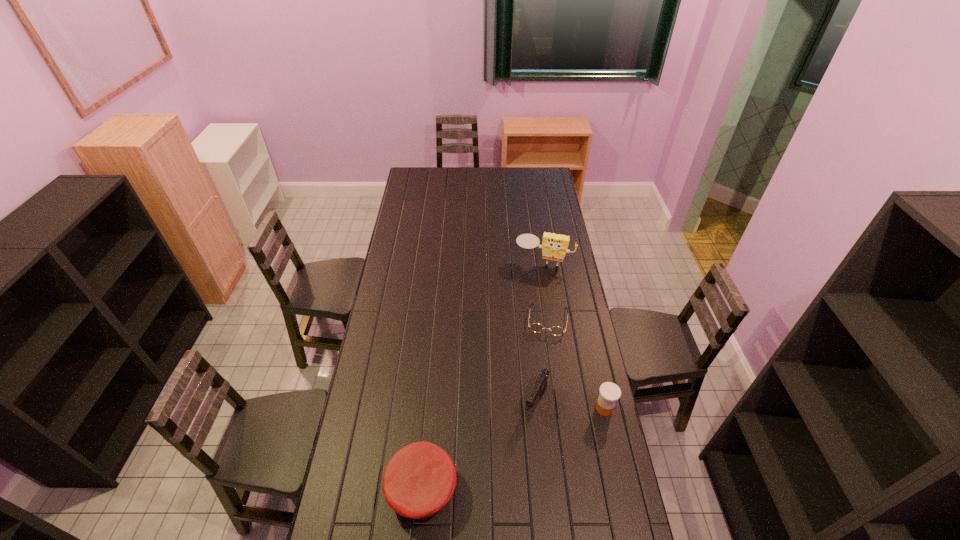
In order to click on free region at the right edge of the desktop in this screenshot , I will do `click(539, 199)`.

Where is `free space at the far right corner`? The image size is (960, 540). free space at the far right corner is located at coordinates (538, 172).

You are a GUI agent. You are given a task and a screenshot of the screen. Output one action in this format:
    pyautogui.click(x=<x>, y=<y>)
    Task: Click on the empty space that is in between the second farthest object and the pistol
    
    Given the screenshot: What is the action you would take?
    pyautogui.click(x=541, y=360)

This screenshot has height=540, width=960. Identify the location of free space between the fourth nearest object and the pistol. (541, 360).

I want to click on blank region between the medicine and the pistol, so click(x=570, y=405).

The width and height of the screenshot is (960, 540). Identify the location of free point between the shortest object and the nearest object. (485, 404).

Find the location of a particular element. free space that is in between the pistol and the shortest object is located at coordinates (541, 360).

Locate an element on the screen. This screenshot has height=540, width=960. unoccupied position between the pistol and the nearest object is located at coordinates (479, 446).

Locate an element on the screen. The image size is (960, 540). empty space that is in between the spectacles and the tallest object is located at coordinates (545, 291).

Locate an element on the screen. This screenshot has height=540, width=960. empty space between the pistol and the fourth nearest object is located at coordinates (541, 360).